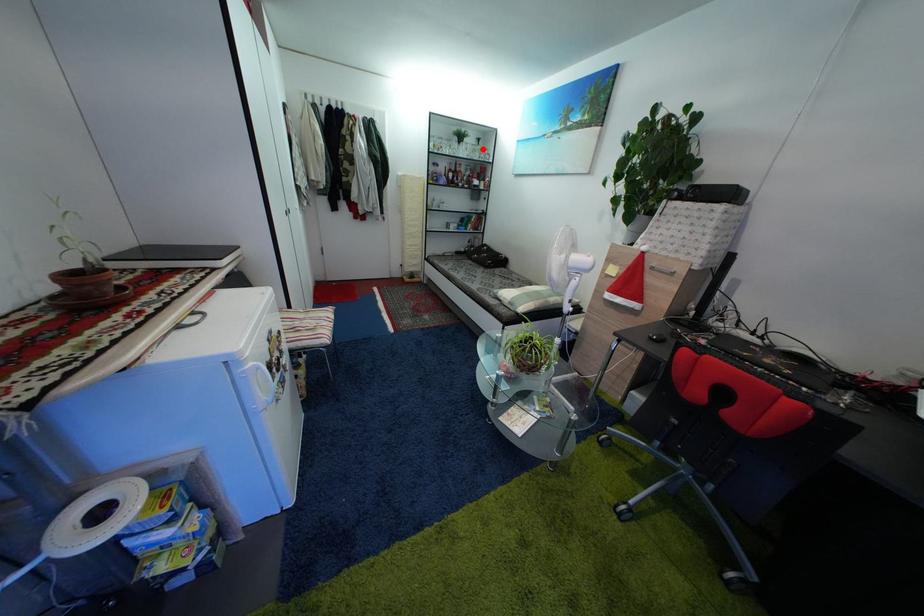
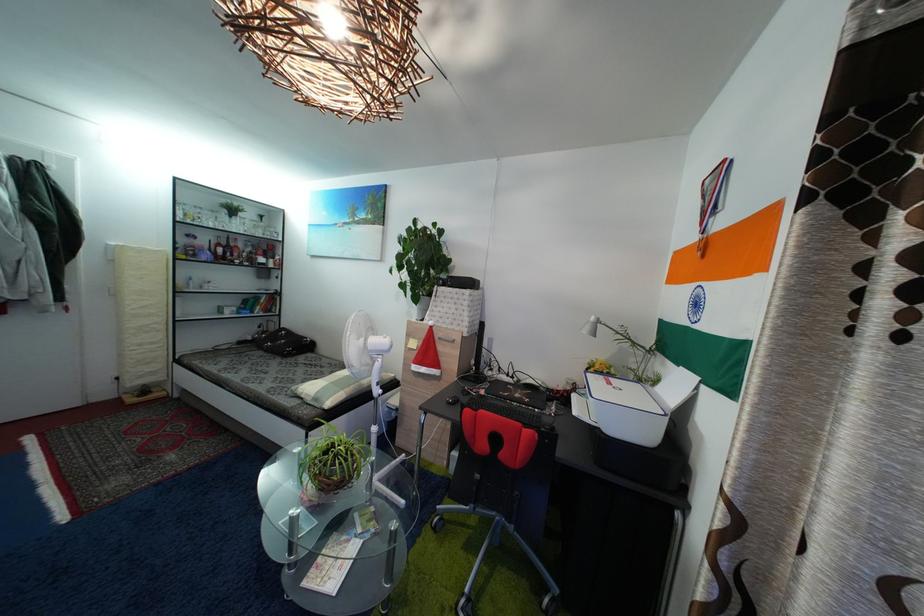
Locate, in the second image, the point that corresponds to the highlighted location in the first image.

(264, 225)